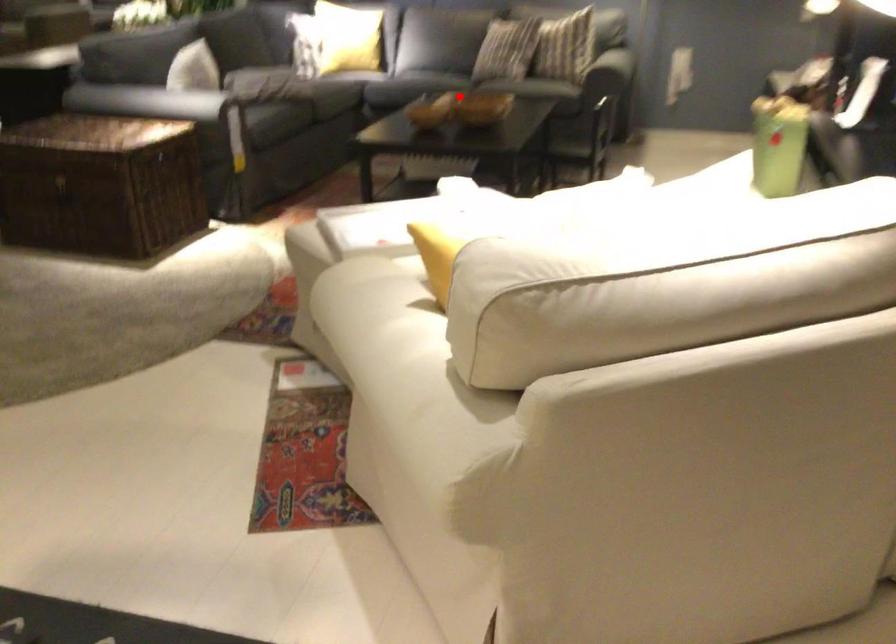
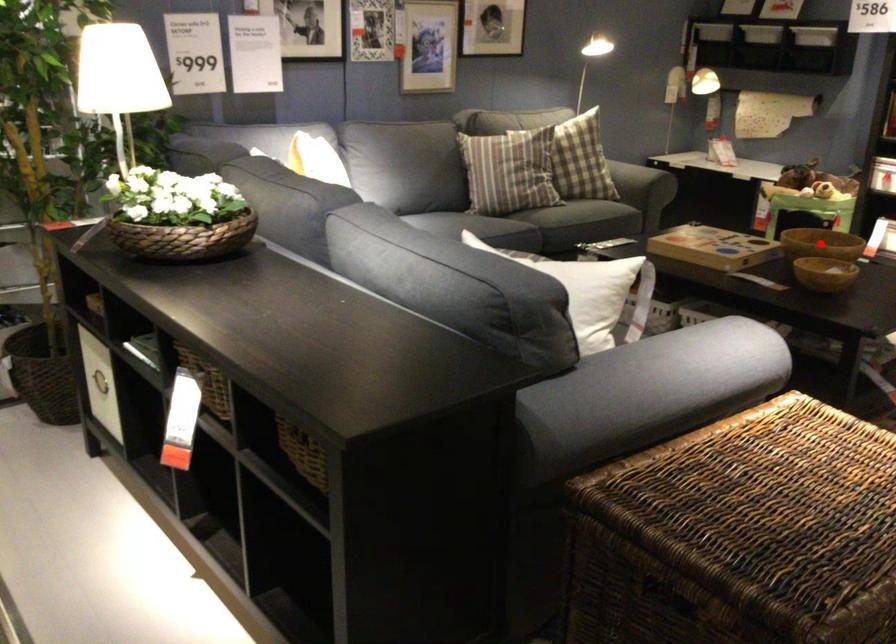
I am providing you with two images of the same scene from different viewpoints. A red point is marked on the first image and another point is marked on the second image. Is the red point in image1 aligned with the point shown in image2?

Yes